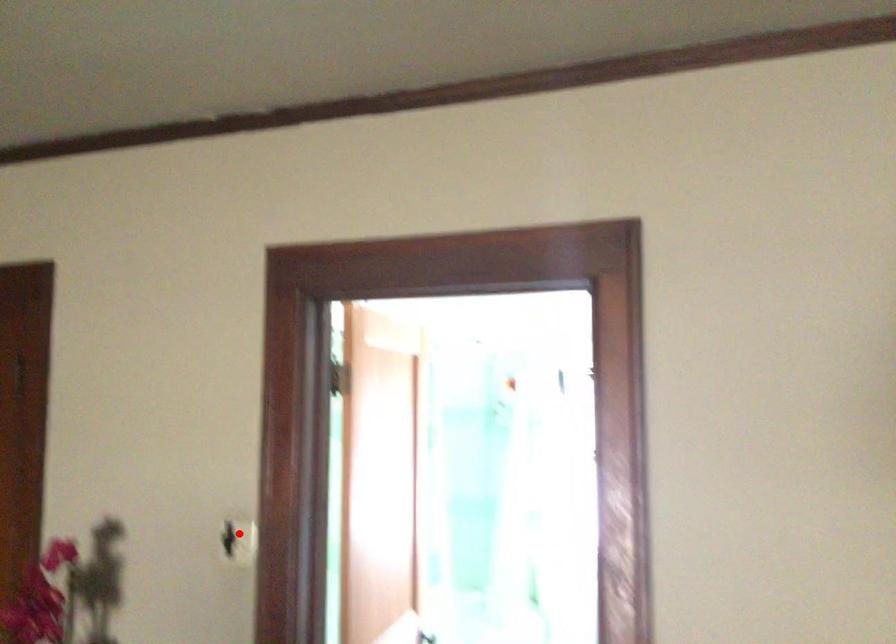
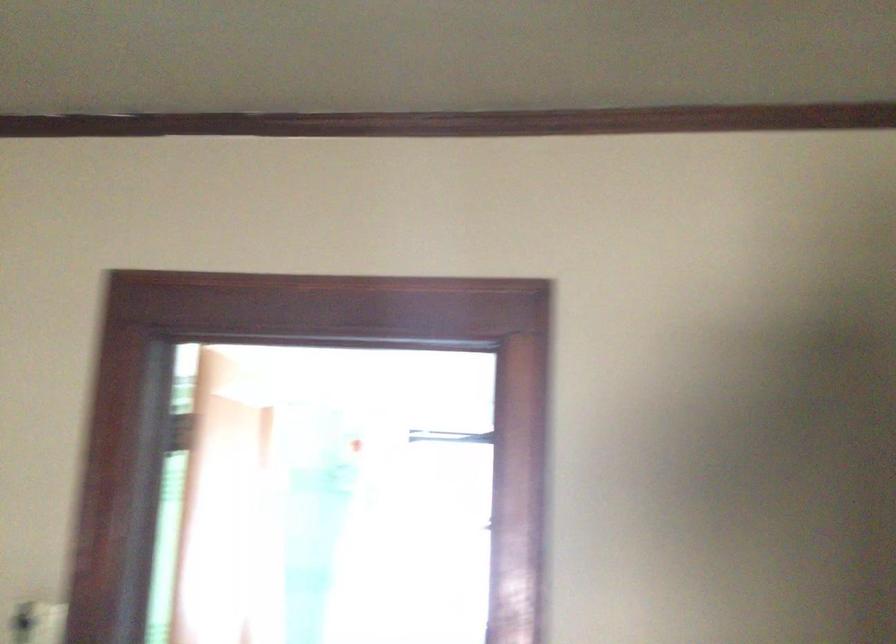
In the second image, find the point that corresponds to the highlighted location in the first image.

(36, 623)